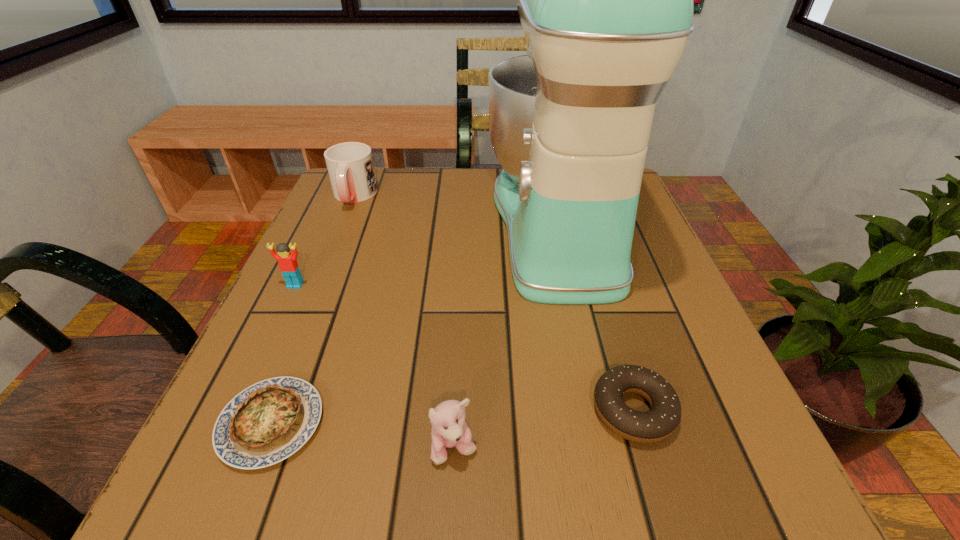
This screenshot has width=960, height=540. I want to click on empty location between the Lego and the tallest object, so [x=426, y=255].

In order to click on empty space that is in between the quiche and the teddy bear in this screenshot , I will do `click(363, 436)`.

Identify the location of object that ranks as the third closest to the mug. (269, 421).

Identify the location of object that is the fifth closest one to the doughnut. (350, 166).

What are the coordinates of `vacant region that satisfies the following two spatial constraints: 1. at the base of the mixer; 2. on the face of the Lego` in the screenshot? It's located at (571, 285).

Where is `free space in the image that satisfies the following two spatial constraints: 1. on the face of the quiche; 2. on the right side of the Lego`? The image size is (960, 540). free space in the image that satisfies the following two spatial constraints: 1. on the face of the quiche; 2. on the right side of the Lego is located at coordinates (230, 423).